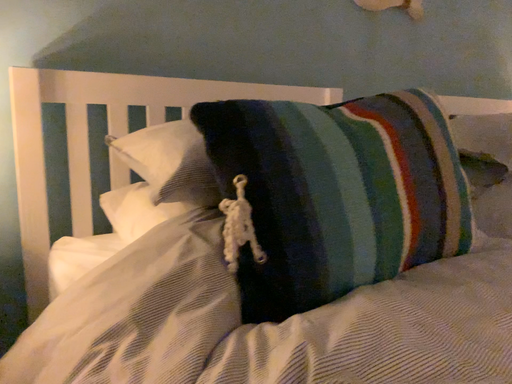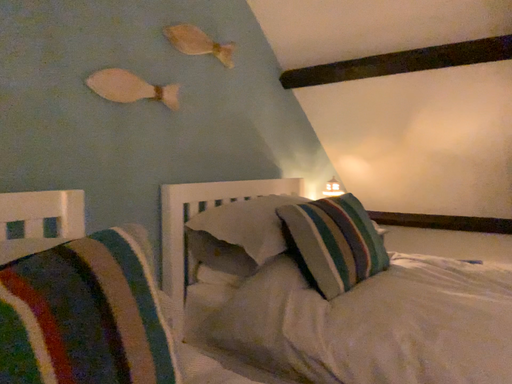
Question: How did the camera likely rotate when shooting the video?

Choices:
 (A) rotated left
 (B) rotated right

Answer: (B)